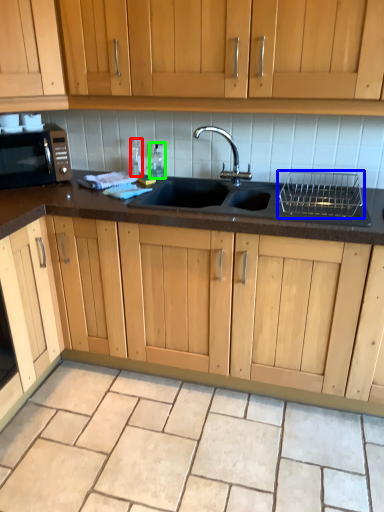
Question: Estimate the real-world distances between objects in this image. Which object is farther from bottle (highlighted by a red box), appliance (highlighted by a blue box) or bottle (highlighted by a green box)?

Choices:
 (A) appliance
 (B) bottle

Answer: (A)